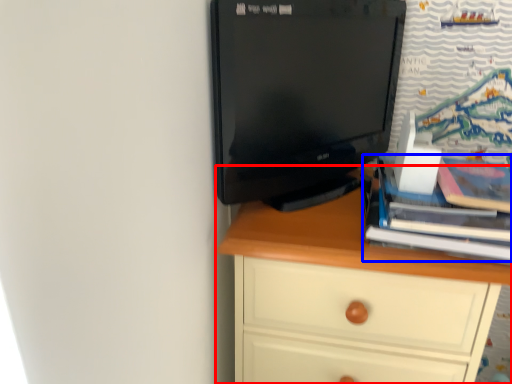
Question: Among these objects, which one is farthest to the camera, chest of drawers (highlighted by a red box) or book (highlighted by a blue box)?

Choices:
 (A) chest of drawers
 (B) book

Answer: (A)